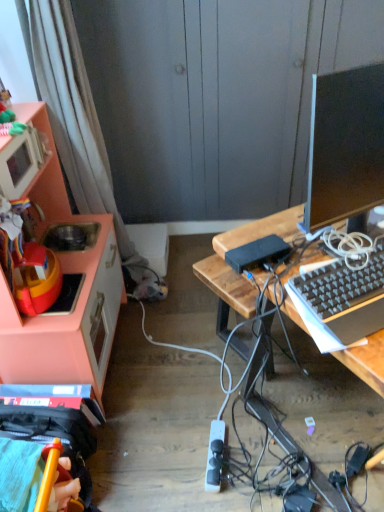
Describe the element at coordinates (258, 253) in the screenshot. I see `black matte power bank at center` at that location.

In the scene shown: Measure the distance between point (258, 245) and camera.

Point (258, 245) and camera are 3.71 feet apart from each other.

Describe the element at coordinates (235, 247) in the screenshot. I see `wooden desk at center` at that location.

Describe the element at coordinates (345, 146) in the screenshot. I see `black glossy monitor at right` at that location.

The image size is (384, 512). Describe the element at coordinates (214, 456) in the screenshot. I see `white plastic power outlet at lower center` at that location.

Image resolution: width=384 pixels, height=512 pixels. I want to click on white fabric curtain at left, so click(73, 113).

Is the position of wooden desk at center more distant than that of black matte power bank at center?

No, wooden desk at center is closer to the camera.

Considering the relative sizes of wooden desk at center and black matte power bank at center in the image provided, is wooden desk at center smaller than black matte power bank at center?

No, wooden desk at center is not smaller than black matte power bank at center.

Considering the relative sizes of wooden desk at center and black matte power bank at center in the image provided, is wooden desk at center taller than black matte power bank at center?

Indeed, wooden desk at center has a greater height compared to black matte power bank at center.

Is wooden desk at center positioned with its back to black glossy monitor at right?

That's not correct — wooden desk at center is not looking away from black glossy monitor at right.

Are wooden desk at center and black glossy monitor at right beside each other?

They are not placed beside each other.

Is wooden desk at center further to the viewer compared to black glossy monitor at right?

That is True.

Find the location of `desk behind the black glossy monitor at right`. desk behind the black glossy monitor at right is located at coordinates (235, 247).

Is white plastic power outlet at lower center shorter than white fabric curtain at left?

Indeed, white plastic power outlet at lower center has a lesser height compared to white fabric curtain at left.

Can you confirm if white plastic power outlet at lower center is bigger than white fabric curtain at left?

Incorrect, white plastic power outlet at lower center is not larger than white fabric curtain at left.

From a real-world perspective, which is physically above, white plastic power outlet at lower center or white fabric curtain at left?

From a 3D spatial view, white fabric curtain at left is above.

This screenshot has width=384, height=512. I want to click on power outlet that appears behind the white fabric curtain at left, so click(x=214, y=456).

Relative to wooden desk at center, is black glossy monitor at right in front or behind?

Visually, black glossy monitor at right is located in front of wooden desk at center.

Between black glossy monitor at right and wooden desk at center, which one appears on the left side from the viewer's perspective?

black glossy monitor at right.

From a real-world perspective, is black glossy monitor at right on wooden desk at center?

Correct, in the physical world, black glossy monitor at right is higher than wooden desk at center.

Can you confirm if black glossy monitor at right is shorter than wooden desk at center?

Yes, black glossy monitor at right is shorter than wooden desk at center.

Based on the photo, which object is positioned more to the left, black glossy monitor at right or pink matte cabinet at left?

pink matte cabinet at left is more to the left.

Does black glossy monitor at right turn towards pink matte cabinet at left?

No, black glossy monitor at right is not facing towards pink matte cabinet at left.

From the image's perspective, is black glossy monitor at right located above or below pink matte cabinet at left?

Result: From the image's perspective, black glossy monitor at right appears above pink matte cabinet at left.

Considering the sizes of objects black glossy monitor at right and pink matte cabinet at left in the image provided, who is smaller, black glossy monitor at right or pink matte cabinet at left?

black glossy monitor at right is smaller.

This screenshot has width=384, height=512. In the image, there is a white fabric curtain at left. What are the coordinates of `desk below it (from the image's perspective)` in the screenshot? It's located at pyautogui.click(x=235, y=247).

In terms of width, does white fabric curtain at left look wider or thinner when compared to wooden desk at center?

Considering their sizes, white fabric curtain at left looks slimmer than wooden desk at center.

From the image's perspective, does white fabric curtain at left appear lower than wooden desk at center?

Actually, white fabric curtain at left appears above wooden desk at center in the image.

Considering the sizes of objects white fabric curtain at left and wooden desk at center in the image provided, who is bigger, white fabric curtain at left or wooden desk at center?

wooden desk at center is bigger.

Is black matte power bank at center completely or partially inside black glossy monitor at right?

Definitely not — black matte power bank at center is not inside black glossy monitor at right.

From the image's perspective, is black glossy monitor at right on black matte power bank at center?

Indeed, from the image's perspective, black glossy monitor at right is shown above black matte power bank at center.

Is black glossy monitor at right bigger than black matte power bank at center?

Yes.

From a real-world perspective, does black glossy monitor at right stand above black matte power bank at center?

Indeed, from a real-world perspective, black glossy monitor at right stands above black matte power bank at center.

At what (x,y) coordinates should I click in order to perform the action: click on desk lying in front of the black matte power bank at center. Please return your answer as a coordinate pair (x, y). Looking at the image, I should click on (235, 247).

Image resolution: width=384 pixels, height=512 pixels. What are the coordinates of `desk on the right of black glossy monitor at right` in the screenshot? It's located at (235, 247).

Looking at the image, which one is located closer to black matte power bank at center, black plastic keyboard at right or pink matte cabinet at left?

The object closer to black matte power bank at center is black plastic keyboard at right.

When comparing their distances from wooden desk at center, does black matte power bank at center or white fabric curtain at left seem further?

The object further to wooden desk at center is white fabric curtain at left.

From the picture: Considering their positions, is white fabric curtain at left positioned further to wooden desk at center than white plastic power outlet at lower center?

white fabric curtain at left is further to wooden desk at center.

When comparing their distances from wooden desk at center, does white fabric curtain at left or black plastic keyboard at right seem further?

white fabric curtain at left lies further to wooden desk at center than the other object.

Based on their spatial positions, is wooden desk at center or white fabric curtain at left further from black matte power bank at center?

white fabric curtain at left lies further to black matte power bank at center than the other object.

When comparing their distances from black matte power bank at center, does white fabric curtain at left or white plastic power outlet at lower center seem further?

white fabric curtain at left is positioned further to the anchor black matte power bank at center.

Looking at this image, which object lies nearer to the anchor point black matte power bank at center, white fabric curtain at left or pink matte cabinet at left?

pink matte cabinet at left is closer to black matte power bank at center.

When comparing their distances from pink matte cabinet at left, does white fabric curtain at left or black plastic keyboard at right seem further?

Based on the image, black plastic keyboard at right appears to be further to pink matte cabinet at left.

Identify the location of desk between black matte power bank at center and white plastic power outlet at lower center in the up-down direction. The width and height of the screenshot is (384, 512). (235, 247).

Where is `computer keyboard between black matte power bank at center and wooden desk at center from left to right`? computer keyboard between black matte power bank at center and wooden desk at center from left to right is located at coordinates (340, 302).

Find the location of a particular element. The image size is (384, 512). computer keyboard that lies between black matte power bank at center and white plastic power outlet at lower center from top to bottom is located at coordinates click(340, 302).

Identify the location of television situated between black matte power bank at center and wooden desk at center from left to right. (345, 146).